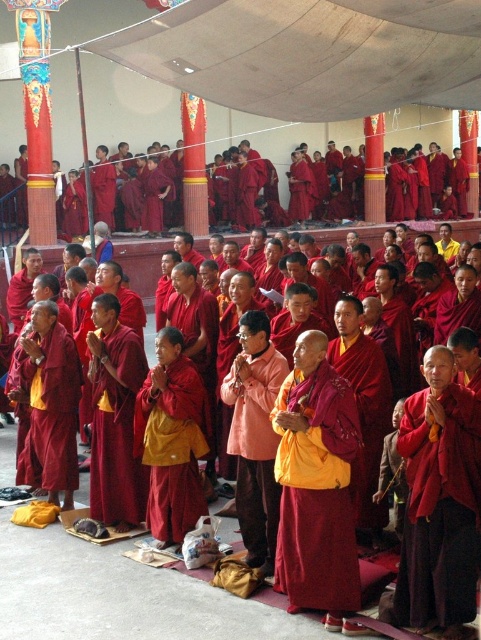
Question: From the image, what is the correct spatial relationship of matte red robe at lower right in relation to matte red robe at center?

Choices:
 (A) above
 (B) below

Answer: (B)

Question: Where is yellow matte robe at center located in relation to maroon silk robe at center in the image?

Choices:
 (A) above
 (B) below

Answer: (A)

Question: Can you confirm if matte yellow robe at center is positioned above matte red robe at lower right?

Choices:
 (A) yes
 (B) no

Answer: (A)

Question: Among these points, which one is farthest from the camera?

Choices:
 (A) (103, 388)
 (B) (174, 426)
 (C) (249, 493)

Answer: (A)

Question: Based on their relative distances, which object is farther from the matte red robe at lower right?

Choices:
 (A) matte orange robe at center
 (B) matte yellow robe at center
 (C) yellow matte robe at center

Answer: (C)

Question: Which point appears farthest from the camera in this image?

Choices:
 (A) (41, 364)
 (B) (270, 442)
 (C) (177, 376)
 (D) (126, 365)

Answer: (A)